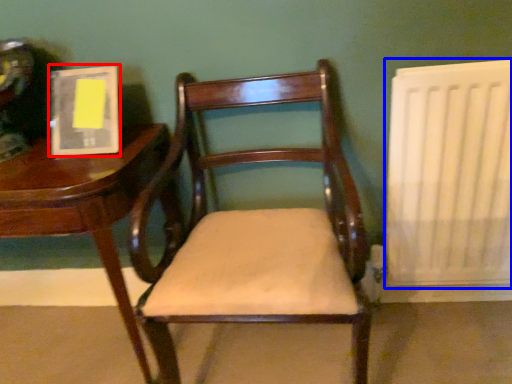
Question: Among these objects, which one is farthest to the camera, book (highlighted by a red box) or radiator (highlighted by a blue box)?

Choices:
 (A) book
 (B) radiator

Answer: (A)